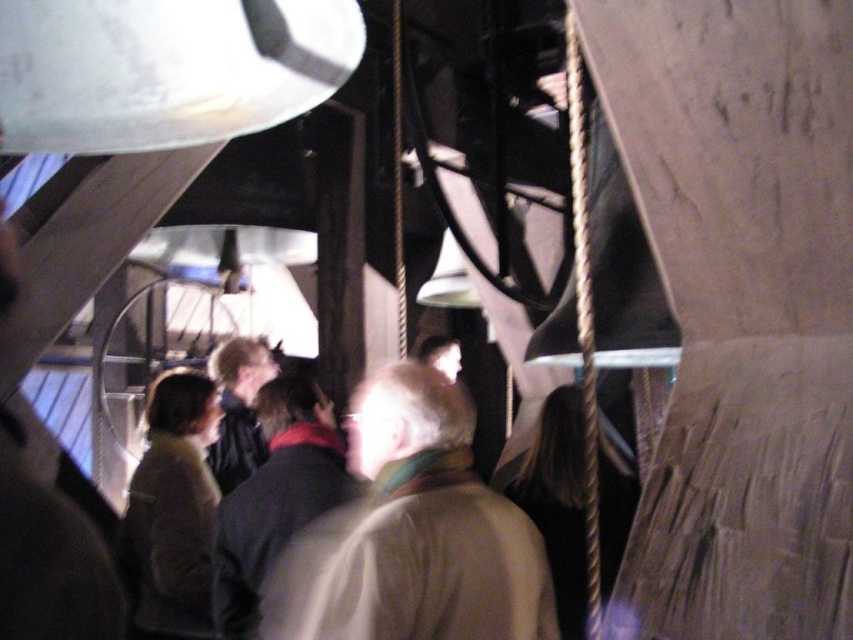
Question: Is light brown leather jacket at center above gold metallic rope at right?

Choices:
 (A) no
 (B) yes

Answer: (A)

Question: Which object appears farthest from the camera in this image?

Choices:
 (A) light brown leather jacket at center
 (B) gold metallic rope at right

Answer: (B)

Question: Is light brown leather jacket at center to the left of gold metallic rope at right from the viewer's perspective?

Choices:
 (A) no
 (B) yes

Answer: (B)

Question: Which point appears farthest from the camera in this image?

Choices:
 (A) (583, 296)
 (B) (540, 557)

Answer: (B)

Question: Among these points, which one is farthest from the camera?

Choices:
 (A) (573, 256)
 (B) (322, 600)

Answer: (A)

Question: Is light brown leather jacket at center smaller than gold metallic rope at right?

Choices:
 (A) no
 (B) yes

Answer: (B)